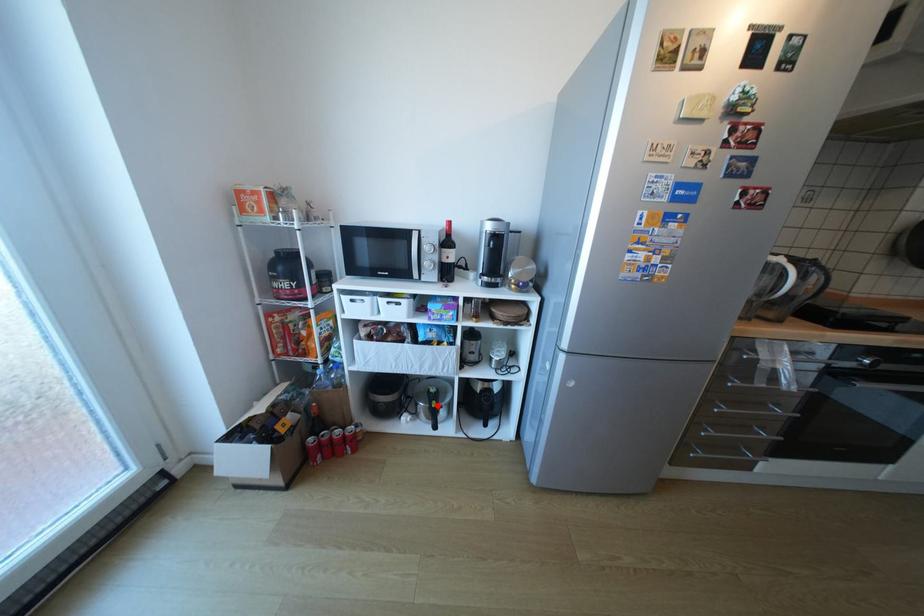
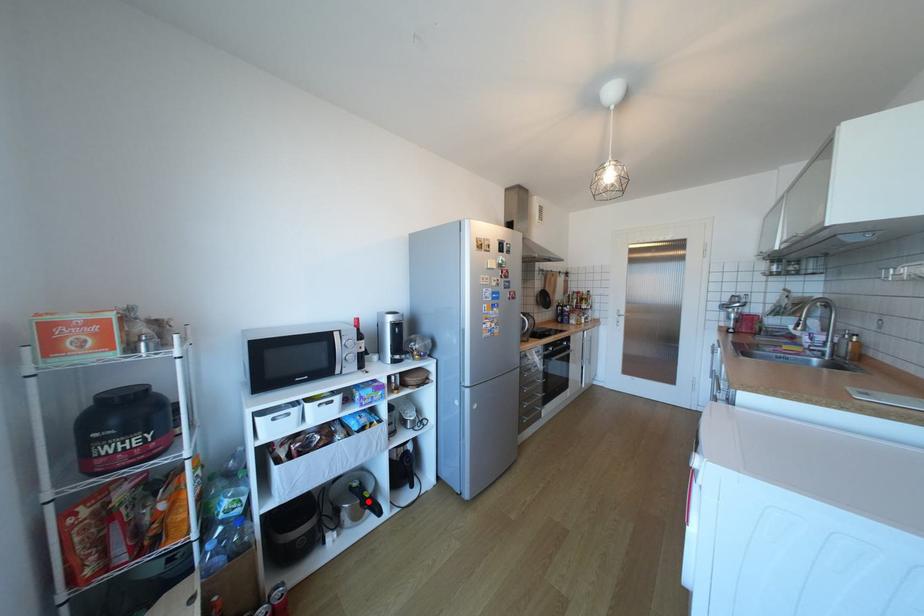
I am providing you with two images of the same scene from different viewpoints. A red point is marked on the first image and another point is marked on the second image. Is the red point in image1 aligned with the point shown in image2?

Yes